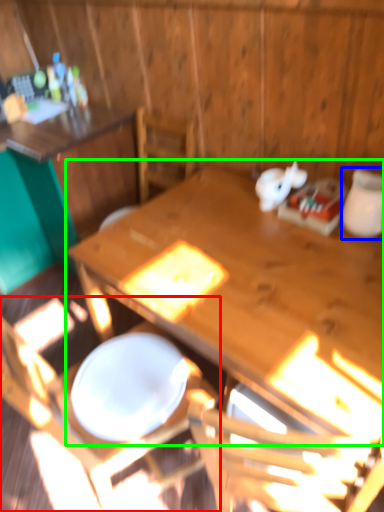
Question: Estimate the real-world distances between objects in this image. Which object is farther from chair (highlighted by a red box), tableware (highlighted by a blue box) or table (highlighted by a green box)?

Choices:
 (A) tableware
 (B) table

Answer: (A)